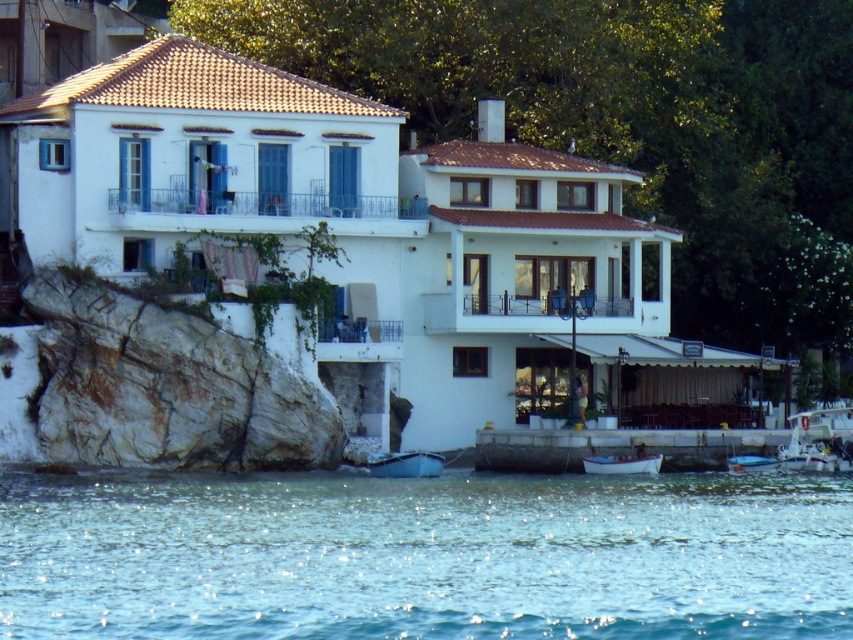
You are standing at the point labeled as point [165,385] on the image. What object are you currently standing on?

You are standing on the white rock at lower left indicated by point [165,385].

Based on the photo, you are a photographer planning to capture the waterfront scene. You want to ensure that both the white rock at lower left and the metallic blue boat at lower right are clearly visible in your shot. Given their sizes, which object should you frame closer to the front of the image to maintain their relative sizes as seen in the original scene?

The white rock at lower left is larger than the metallic blue boat at lower right. To maintain their relative sizes, you should frame the white rock at lower left closer to the front of the image since larger objects placed closer to the front can appear proportionally larger compared to smaller objects placed further back.